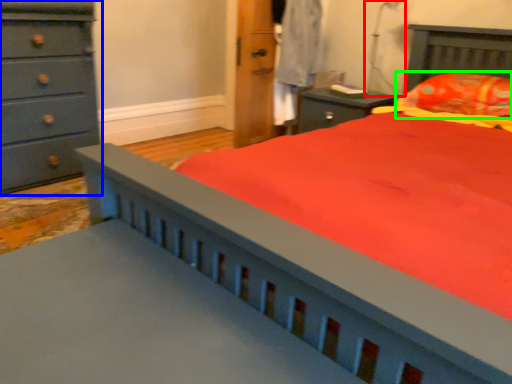
Question: Which is nearer to the table lamp (highlighted by a red box)? chest of drawers (highlighted by a blue box) or pillow (highlighted by a green box).

Choices:
 (A) chest of drawers
 (B) pillow

Answer: (B)